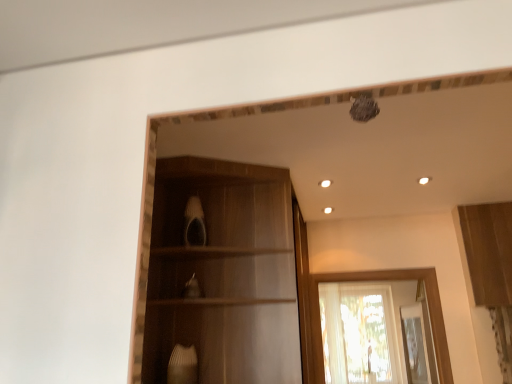
Question: From a real-world perspective, does translucent fabric window at center sit lower than wooden cabinet at center, the 2th cabinetry when ordered from right to left?

Choices:
 (A) no
 (B) yes

Answer: (B)

Question: Is translucent fabric window at center at the left side of wooden cabinet at center, the 2th cabinetry when ordered from right to left?

Choices:
 (A) yes
 (B) no

Answer: (B)

Question: Is translucent fabric window at center outside of wooden cabinet at center, the first cabinetry positioned from the left?

Choices:
 (A) yes
 (B) no

Answer: (A)

Question: Can you confirm if translucent fabric window at center is wider than wooden cabinet at center, the first cabinetry positioned from the left?

Choices:
 (A) yes
 (B) no

Answer: (B)

Question: Does translucent fabric window at center touch wooden cabinet at center, the first cabinetry positioned from the left?

Choices:
 (A) no
 (B) yes

Answer: (A)

Question: Does point (500, 264) appear closer or farther from the camera than point (381, 284)?

Choices:
 (A) farther
 (B) closer

Answer: (B)

Question: Looking at the image, does wooden cabinet at upper right, the second cabinetry in the left-to-right sequence, seem bigger or smaller compared to translucent fabric window at center?

Choices:
 (A) small
 (B) big

Answer: (A)

Question: Is wooden cabinet at upper right, the second cabinetry in the left-to-right sequence, to the left or to the right of translucent fabric window at center in the image?

Choices:
 (A) left
 (B) right

Answer: (B)

Question: From a real-world perspective, relative to translucent fabric window at center, is wooden cabinet at upper right, the 1th cabinetry when ordered from right to left, vertically above or below?

Choices:
 (A) above
 (B) below

Answer: (A)

Question: Visually, is wooden cabinet at upper right, the second cabinetry in the left-to-right sequence, positioned to the left or to the right of wooden cabinet at center, the first cabinetry positioned from the left?

Choices:
 (A) right
 (B) left

Answer: (A)

Question: From a real-world perspective, is wooden cabinet at upper right, the second cabinetry in the left-to-right sequence, physically located above or below wooden cabinet at center, the first cabinetry positioned from the left?

Choices:
 (A) above
 (B) below

Answer: (A)

Question: Considering the positions of wooden cabinet at upper right, the 1th cabinetry when ordered from right to left, and wooden cabinet at center, the 2th cabinetry when ordered from right to left, in the image, is wooden cabinet at upper right, the 1th cabinetry when ordered from right to left, taller or shorter than wooden cabinet at center, the 2th cabinetry when ordered from right to left,?

Choices:
 (A) short
 (B) tall

Answer: (A)

Question: Is wooden cabinet at upper right, the second cabinetry in the left-to-right sequence, situated inside wooden cabinet at center, the first cabinetry positioned from the left, or outside?

Choices:
 (A) outside
 (B) inside

Answer: (A)

Question: From the image's perspective, is wooden cabinet at center, the 2th cabinetry when ordered from right to left, positioned above or below wooden cabinet at upper right, the 1th cabinetry when ordered from right to left?

Choices:
 (A) above
 (B) below

Answer: (B)

Question: Is wooden cabinet at center, the 2th cabinetry when ordered from right to left, inside or outside of wooden cabinet at upper right, the second cabinetry in the left-to-right sequence?

Choices:
 (A) outside
 (B) inside

Answer: (A)